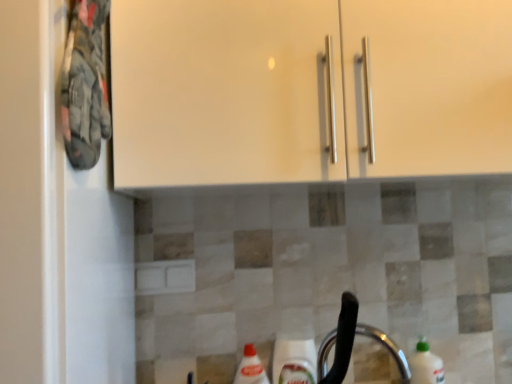
Question: From the image's perspective, is green plastic bottle at lower right located above or below silver metallic faucet at lower center?

Choices:
 (A) above
 (B) below

Answer: (B)

Question: From a real-world perspective, is green plastic bottle at lower right above or below silver metallic faucet at lower center?

Choices:
 (A) above
 (B) below

Answer: (B)

Question: Is green plastic bottle at lower right inside the boundaries of silver metallic faucet at lower center, or outside?

Choices:
 (A) outside
 (B) inside

Answer: (A)

Question: In the image, is silver metallic faucet at lower center positioned in front of or behind green plastic bottle at lower right?

Choices:
 (A) behind
 (B) front

Answer: (B)

Question: Looking at the image, does silver metallic faucet at lower center seem bigger or smaller compared to green plastic bottle at lower right?

Choices:
 (A) small
 (B) big

Answer: (B)

Question: Is silver metallic faucet at lower center wider or thinner than green plastic bottle at lower right?

Choices:
 (A) wide
 (B) thin

Answer: (A)

Question: From the image's perspective, is silver metallic faucet at lower center positioned above or below green plastic bottle at lower right?

Choices:
 (A) below
 (B) above

Answer: (B)